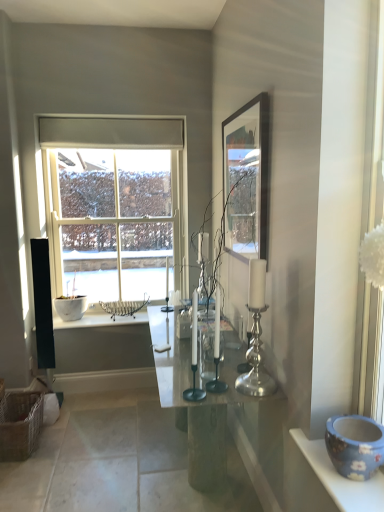
At what (x,y) coordinates should I click in order to perform the action: click on vacant region to the left of polished glass table at center. Please return your answer as a coordinate pair (x, y). The width and height of the screenshot is (384, 512). Looking at the image, I should click on (97, 453).